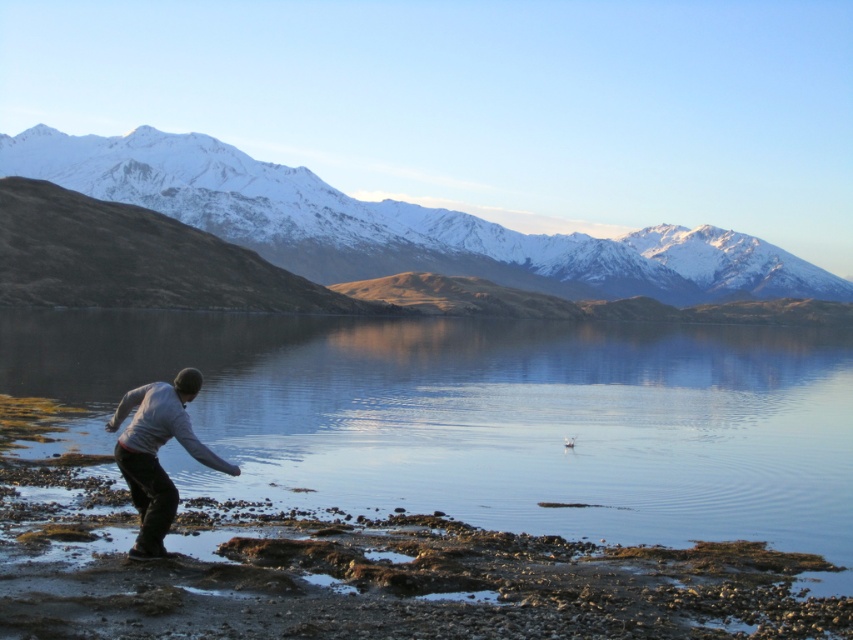
Can you confirm if snowy rocky mountain at upper center is shorter than gray cotton sweater at lower left?

In fact, snowy rocky mountain at upper center may be taller than gray cotton sweater at lower left.

Which is more to the right, snowy rocky mountain at upper center or gray cotton sweater at lower left?

snowy rocky mountain at upper center

Is point (579, 252) positioned after point (136, 477)?

Yes, it is behind point (136, 477).

Locate an element on the screen. snowy rocky mountain at upper center is located at coordinates (399, 225).

Who is lower down, smooth water at center or snowy rocky mountain at upper center?

Positioned lower is smooth water at center.

Can you confirm if smooth water at center is shorter than snowy rocky mountain at upper center?

Indeed, smooth water at center has a lesser height compared to snowy rocky mountain at upper center.

Where is `smooth water at center`? smooth water at center is located at coordinates (485, 417).

Does smooth water at center lie behind gray cotton sweater at lower left?

Yes, it is.

Is smooth water at center below gray cotton sweater at lower left?

No, smooth water at center is not below gray cotton sweater at lower left.

Is point (763, 436) less distant than point (114, 452)?

No, (763, 436) is behind (114, 452).

This screenshot has height=640, width=853. I want to click on smooth water at center, so click(485, 417).